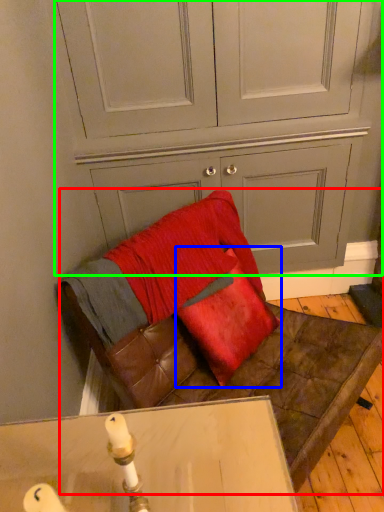
Question: Considering the real-world distances, which object is farthest from furniture (highlighted by a red box)? throw pillow (highlighted by a blue box) or dresser (highlighted by a green box)?

Choices:
 (A) throw pillow
 (B) dresser

Answer: (B)